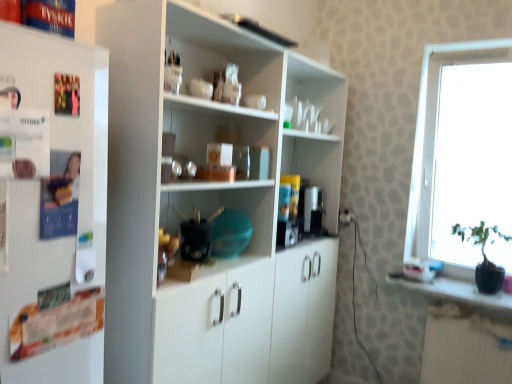
Question: Is white matte cupboard at center next to black glossy pot at right and touching it?

Choices:
 (A) no
 (B) yes

Answer: (A)

Question: Is white matte cupboard at center at the left side of black glossy pot at right?

Choices:
 (A) yes
 (B) no

Answer: (A)

Question: Is white matte cupboard at center to the right of black glossy pot at right from the viewer's perspective?

Choices:
 (A) no
 (B) yes

Answer: (A)

Question: From a real-world perspective, is white matte cupboard at center under black glossy pot at right?

Choices:
 (A) yes
 (B) no

Answer: (B)

Question: Considering the relative positions of white matte cupboard at center and black glossy pot at right in the image provided, is white matte cupboard at center in front of black glossy pot at right?

Choices:
 (A) no
 (B) yes

Answer: (B)

Question: In terms of height, does transparent glass window at right look taller or shorter compared to matte plastic coffee machine at center?

Choices:
 (A) tall
 (B) short

Answer: (A)

Question: Looking at the image, does transparent glass window at right seem bigger or smaller compared to matte plastic coffee machine at center?

Choices:
 (A) small
 (B) big

Answer: (B)

Question: Is transparent glass window at right inside or outside of matte plastic coffee machine at center?

Choices:
 (A) outside
 (B) inside

Answer: (A)

Question: Is transparent glass window at right in front of or behind matte plastic coffee machine at center in the image?

Choices:
 (A) front
 (B) behind

Answer: (A)

Question: In terms of height, does transparent glass window at right look taller or shorter compared to white matte cupboard at center?

Choices:
 (A) short
 (B) tall

Answer: (A)

Question: Does point (464, 69) appear closer or farther from the camera than point (276, 289)?

Choices:
 (A) farther
 (B) closer

Answer: (A)

Question: In terms of width, does transparent glass window at right look wider or thinner when compared to white matte cupboard at center?

Choices:
 (A) wide
 (B) thin

Answer: (B)

Question: From the image's perspective, is transparent glass window at right located above or below white matte cupboard at center?

Choices:
 (A) above
 (B) below

Answer: (A)

Question: From a real-world perspective, relative to white matte refrigerator at left, is matte plastic coffee machine at center vertically above or below?

Choices:
 (A) below
 (B) above

Answer: (A)

Question: From the image's perspective, is matte plastic coffee machine at center above or below white matte refrigerator at left?

Choices:
 (A) above
 (B) below

Answer: (B)